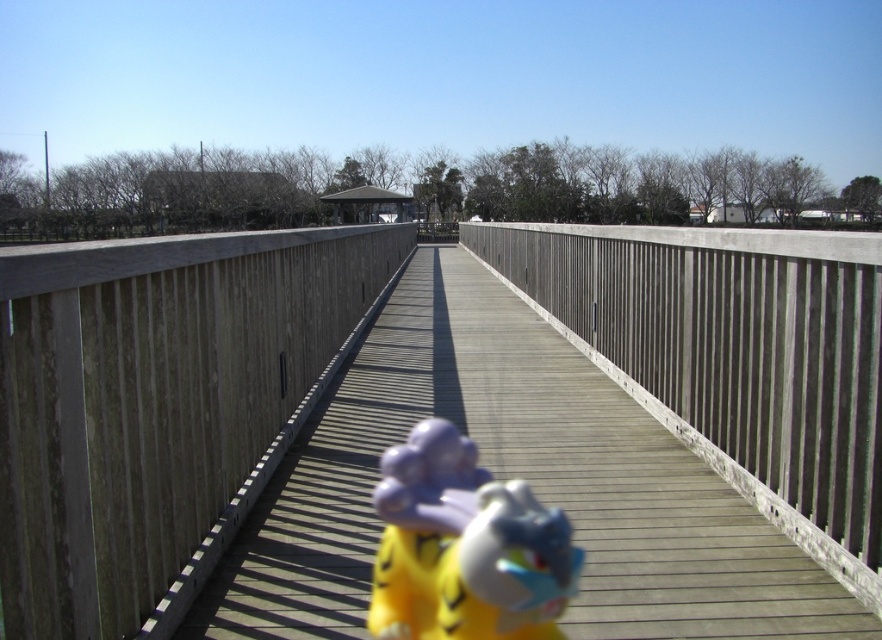
Question: Can you confirm if wooden bridge at center is thinner than yellow plush toy at center?

Choices:
 (A) no
 (B) yes

Answer: (A)

Question: Which of the following is the farthest from the observer?

Choices:
 (A) (267, 269)
 (B) (405, 628)

Answer: (A)

Question: Is wooden bridge at center smaller than yellow plush toy at center?

Choices:
 (A) no
 (B) yes

Answer: (A)

Question: Can you confirm if wooden bridge at center is positioned to the left of yellow plush toy at center?

Choices:
 (A) no
 (B) yes

Answer: (B)